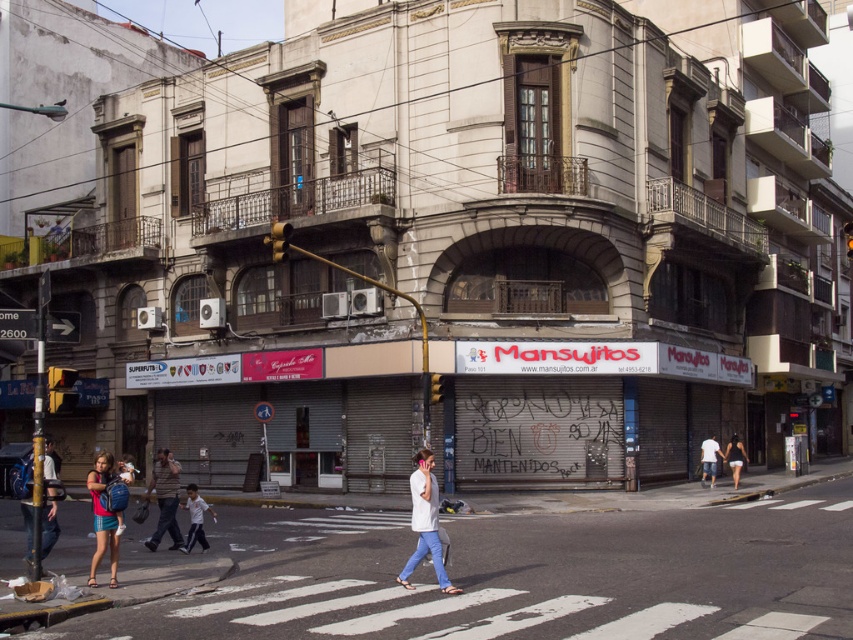
Who is taller, white pedestrian crossing at center or brown leather jacket at center?

brown leather jacket at center is taller.

Which is more to the right, white pedestrian crossing at center or brown leather jacket at center?

Positioned to the right is white pedestrian crossing at center.

Locate an element on the screen. Image resolution: width=853 pixels, height=640 pixels. white pedestrian crossing at center is located at coordinates (524, 577).

Where is `white pedestrian crossing at center`? The image size is (853, 640). white pedestrian crossing at center is located at coordinates [x=524, y=577].

How distant is white matte shirt at center from white cotton shirt at center-right?

white matte shirt at center and white cotton shirt at center-right are 13.37 meters apart from each other.

Does white matte shirt at center appear on the right side of white cotton shirt at center-right?

Answer: No, white matte shirt at center is not to the right of white cotton shirt at center-right.

At what (x,y) coordinates should I click in order to perform the action: click on white matte shirt at center. Please return your answer as a coordinate pair (x, y). Image resolution: width=853 pixels, height=640 pixels. Looking at the image, I should click on (425, 522).

I want to click on white matte shirt at center, so click(425, 522).

What do you see at coordinates (709, 458) in the screenshot? I see `white cotton shirt at center-right` at bounding box center [709, 458].

Can you confirm if white cotton shirt at center-right is taller than dark blue jeans at lower right?

Yes.

Locate an element on the screen. The image size is (853, 640). white cotton shirt at center-right is located at coordinates (709, 458).